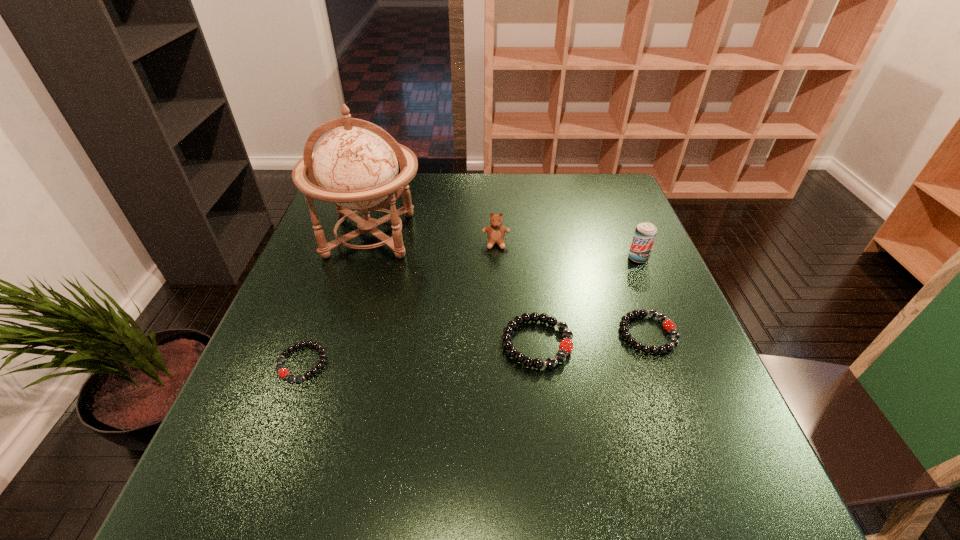
The image size is (960, 540). In order to click on object at the far left corner in this screenshot , I will do `click(354, 166)`.

At what (x,y) coordinates should I click in order to perform the action: click on free point at the far edge. Please return your answer as a coordinate pair (x, y). Looking at the image, I should click on tap(516, 191).

In the image, there is a desktop. Find the location of `vacant region at the near edge`. vacant region at the near edge is located at coordinates (628, 412).

Locate an element on the screen. This screenshot has width=960, height=540. free region at the left edge of the desktop is located at coordinates (306, 265).

Find the location of a particular element. Image resolution: width=960 pixels, height=540 pixels. vacant space at the right edge is located at coordinates (585, 225).

Identify the location of vacant space at the near left corner. (263, 421).

Locate an element on the screen. The height and width of the screenshot is (540, 960). vacant area between the rightmost bracelet and the second bracelet from right to left is located at coordinates (592, 339).

At what (x,y) coordinates should I click in order to perform the action: click on free space between the rightmost bracelet and the beer can. Please return your answer as a coordinate pair (x, y). The height and width of the screenshot is (540, 960). Looking at the image, I should click on (643, 296).

At what (x,y) coordinates should I click in order to perform the action: click on free spot between the globe and the second bracelet from right to left. Please return your answer as a coordinate pair (x, y). This screenshot has height=540, width=960. Looking at the image, I should click on (453, 289).

Where is `vacant space in between the globe and the shortest object`? The height and width of the screenshot is (540, 960). vacant space in between the globe and the shortest object is located at coordinates (336, 299).